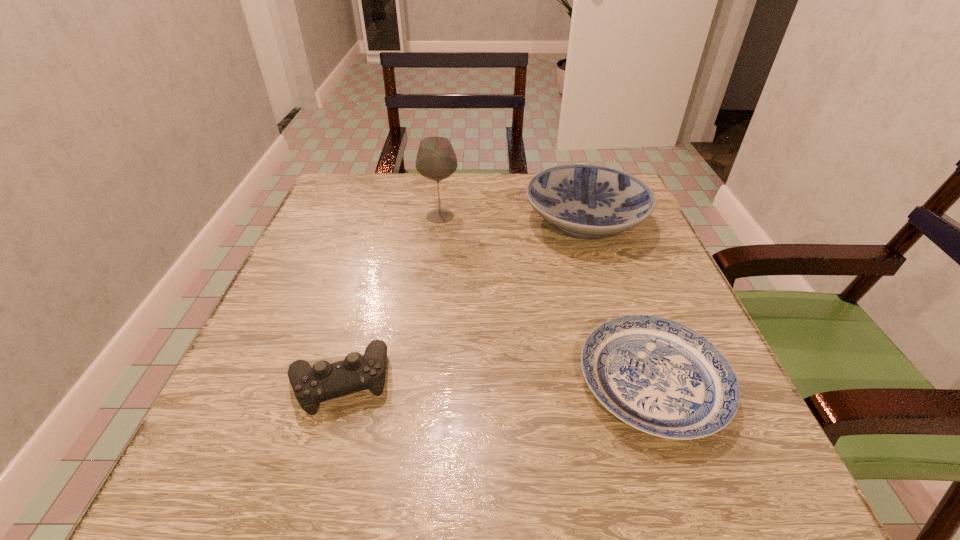
Find the location of a particular element. This screenshot has width=960, height=540. the second object from left to right is located at coordinates (436, 160).

Locate an element on the screen. The image size is (960, 540). wineglass is located at coordinates (436, 160).

I want to click on the taller plate, so click(585, 201).

The image size is (960, 540). Identify the location of the farther plate. (585, 201).

Where is `the leftmost object`? This screenshot has width=960, height=540. the leftmost object is located at coordinates coord(312,385).

The image size is (960, 540). Find the location of `control`. control is located at coordinates (x=312, y=385).

The height and width of the screenshot is (540, 960). Identify the location of the shorter plate. (659, 376).

Where is `the nearer plate`? the nearer plate is located at coordinates (659, 376).

The height and width of the screenshot is (540, 960). Find the location of `vacant space located 0.080m on the right of the wineglass`. vacant space located 0.080m on the right of the wineglass is located at coordinates (492, 216).

Locate an element on the screen. This screenshot has width=960, height=540. vacant space situated 0.140m on the front of the taller plate is located at coordinates (612, 302).